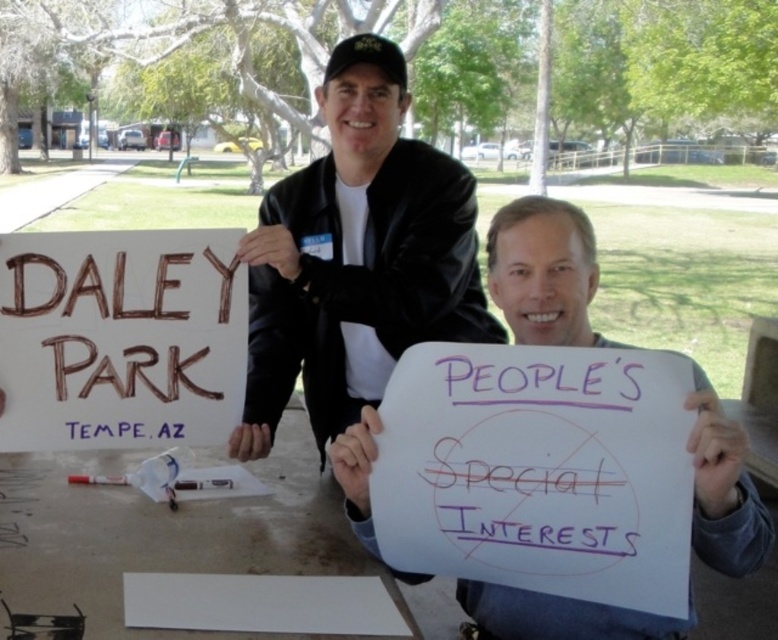
You are a photographer trying to capture the brown cardboard sign at upper left clearly. However, the black leather jacket at center is blocking your view. Can you determine if the jacket is in front of the sign?

The black leather jacket at center is positioned over brown cardboard sign at upper left, so yes, the jacket is blocking the sign and is in front of it.

You are a photographer trying to capture both the black leather jacket at center and the brown cardboard sign at upper left in a single frame. Based on their sizes, which object should you focus on first to ensure it appears larger in the photo?

The black leather jacket at center is taller than the brown cardboard sign at upper left, so focusing on the black leather jacket at center first will ensure it appears larger in the photo.

Where is the black leather jacket at center positioned in the image?

The black leather jacket at center is positioned at coordinates point (356, 257).